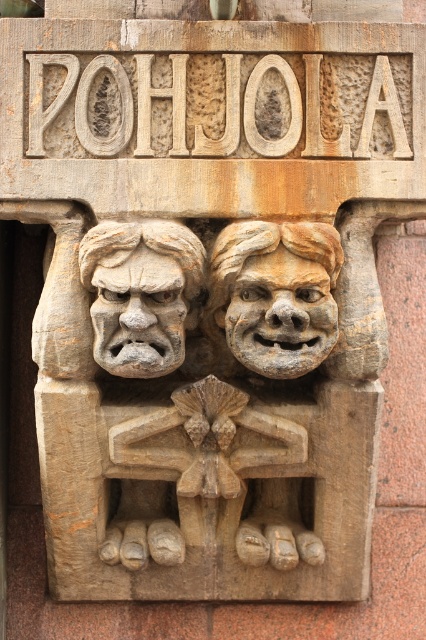
Does carved stone sign at upper center lie in front of matte stone face at center?

No, carved stone sign at upper center is behind matte stone face at center.

Does point (74, 140) come behind point (146, 316)?

Yes, it is.

Which is behind, point (232, 61) or point (118, 305)?

The point (232, 61) is behind.

You are a GUI agent. You are given a task and a screenshot of the screen. Output one action in this format:
    pyautogui.click(x=<x>, y=<y>)
    Task: Click on the carved stone sign at upper center
    The width and height of the screenshot is (426, 640).
    Given the screenshot: What is the action you would take?
    pyautogui.click(x=210, y=115)

Which is below, carved stone face at center or matte stone face at center?

carved stone face at center

Does carved stone face at center have a lesser height compared to matte stone face at center?

Indeed, carved stone face at center has a lesser height compared to matte stone face at center.

Does point (324, 298) come closer to viewer compared to point (132, 356)?

No, it is not.

You are a GUI agent. You are given a task and a screenshot of the screen. Output one action in this format:
    pyautogui.click(x=<x>, y=<y>)
    Task: Click on the carved stone face at center
    
    Given the screenshot: What is the action you would take?
    pyautogui.click(x=281, y=314)

How much distance is there between carved stone sign at upper center and carved stone face at center?

They are 8.07 inches apart.

Based on the photo, between carved stone sign at upper center and carved stone face at center, which one is positioned lower?

carved stone face at center

Locate an element on the screen. carved stone sign at upper center is located at coordinates (210, 115).